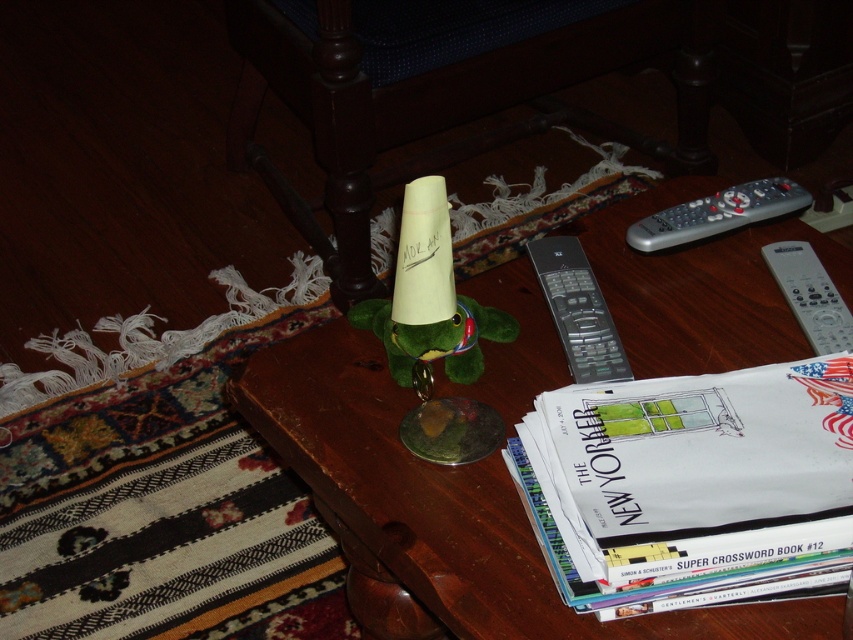
Does point (810, 196) lie behind point (836, 328)?

Yes, point (810, 196) is behind point (836, 328).

Does silver metallic remote at upper right have a greater width compared to white plastic remote at right?

Indeed, silver metallic remote at upper right has a greater width compared to white plastic remote at right.

Find the location of a particular element. Image resolution: width=853 pixels, height=640 pixels. silver metallic remote at upper right is located at coordinates (717, 212).

Identify the location of silver metallic remote at upper right. (717, 212).

Can you confirm if wooden table at center is smaller than white paper book at lower right?

Incorrect, wooden table at center is not smaller in size than white paper book at lower right.

Between point (540, 388) and point (750, 419), which one is positioned behind?

Point (540, 388)

You are a GUI agent. You are given a task and a screenshot of the screen. Output one action in this format:
    pyautogui.click(x=<x>, y=<y>)
    Task: Click on the wooden table at center
    The image size is (853, 640).
    Given the screenshot: What is the action you would take?
    pyautogui.click(x=434, y=509)

The height and width of the screenshot is (640, 853). I want to click on wooden table at center, so click(x=434, y=509).

Measure the distance from wooden table at center to white plastic remote at right.

wooden table at center and white plastic remote at right are 26.79 centimeters apart from each other.

Between wooden table at center and white plastic remote at right, which one appears on the right side from the viewer's perspective?

Positioned to the right is white plastic remote at right.

Is point (778, 349) positioned behind point (793, 307)?

No.

I want to click on wooden table at center, so click(434, 509).